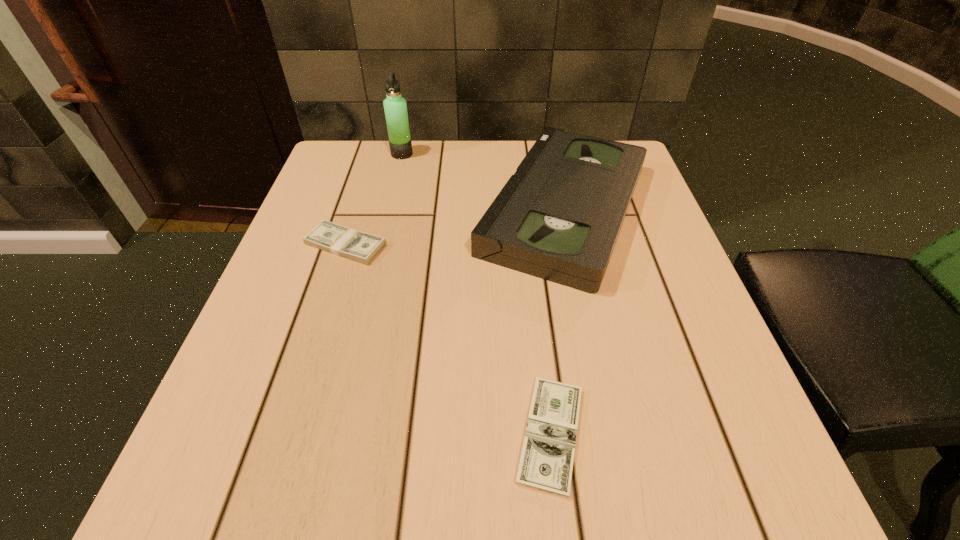
This screenshot has width=960, height=540. In the image, there is a desktop. In order to click on free space at the near left corner in this screenshot , I will do `click(297, 464)`.

This screenshot has height=540, width=960. Find the location of `free space between the taller dollar and the third shortest object`. free space between the taller dollar and the third shortest object is located at coordinates (455, 226).

Find the location of `vacant point located between the third tallest object and the shortest object`. vacant point located between the third tallest object and the shortest object is located at coordinates (448, 340).

Locate an element on the screen. The height and width of the screenshot is (540, 960). free spot between the second tallest object and the right dollar is located at coordinates (558, 321).

I want to click on vacant point located between the second shortest object and the nearest object, so (448, 340).

Locate an element on the screen. The width and height of the screenshot is (960, 540). vacant area that lies between the videotape and the farther dollar is located at coordinates (455, 226).

Image resolution: width=960 pixels, height=540 pixels. I want to click on empty space that is in between the nearest object and the videotape, so click(558, 321).

Where is `vacant region between the second tallest object and the farther dollar`? Image resolution: width=960 pixels, height=540 pixels. vacant region between the second tallest object and the farther dollar is located at coordinates (455, 226).

Locate an element on the screen. This screenshot has height=540, width=960. free spot between the farther dollar and the third shortest object is located at coordinates (455, 226).

At what (x,y) coordinates should I click in order to perform the action: click on vacant space in between the nearer dollar and the second shortest object. Please return your answer as a coordinate pair (x, y). This screenshot has width=960, height=540. Looking at the image, I should click on (448, 340).